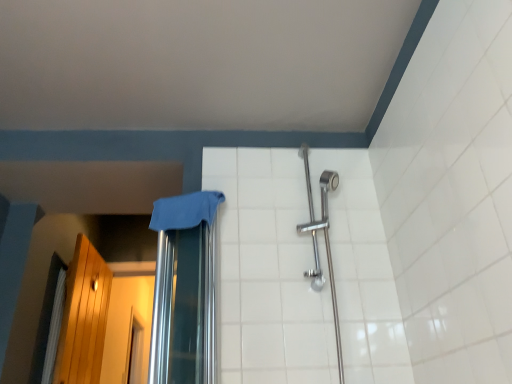
Question: Considering the relative sizes of white fabric shower curtain at left and blue fabric at center in the image provided, is white fabric shower curtain at left shorter than blue fabric at center?

Choices:
 (A) yes
 (B) no

Answer: (B)

Question: Considering the relative positions of white fabric shower curtain at left and blue fabric at center in the image provided, is white fabric shower curtain at left behind blue fabric at center?

Choices:
 (A) yes
 (B) no

Answer: (A)

Question: Is white fabric shower curtain at left at the left side of blue fabric at center?

Choices:
 (A) no
 (B) yes

Answer: (B)

Question: Does white fabric shower curtain at left have a greater height compared to blue fabric at center?

Choices:
 (A) yes
 (B) no

Answer: (A)

Question: From a real-world perspective, is white fabric shower curtain at left located higher than blue fabric at center?

Choices:
 (A) yes
 (B) no

Answer: (B)

Question: Is white fabric shower curtain at left to the left or to the right of wooden screen door at left in the image?

Choices:
 (A) right
 (B) left

Answer: (B)

Question: Considering the positions of white fabric shower curtain at left and wooden screen door at left in the image, is white fabric shower curtain at left taller or shorter than wooden screen door at left?

Choices:
 (A) tall
 (B) short

Answer: (B)

Question: From the image's perspective, is white fabric shower curtain at left above or below wooden screen door at left?

Choices:
 (A) below
 (B) above

Answer: (B)

Question: From a real-world perspective, is white fabric shower curtain at left physically located above or below wooden screen door at left?

Choices:
 (A) below
 (B) above

Answer: (A)

Question: In the image, is wooden screen door at left positioned in front of or behind white fabric shower curtain at left?

Choices:
 (A) behind
 (B) front

Answer: (A)

Question: Is wooden screen door at left wider or thinner than white fabric shower curtain at left?

Choices:
 (A) thin
 (B) wide

Answer: (B)

Question: In the image, is wooden screen door at left on the left side or the right side of white fabric shower curtain at left?

Choices:
 (A) left
 (B) right

Answer: (B)

Question: Is point (65, 311) closer or farther from the camera than point (45, 362)?

Choices:
 (A) closer
 (B) farther

Answer: (B)

Question: Is white ceramic tile at center spatially inside wooden screen door at left, or outside of it?

Choices:
 (A) outside
 (B) inside

Answer: (A)

Question: Based on their positions, is white ceramic tile at center located to the left or right of wooden screen door at left?

Choices:
 (A) right
 (B) left

Answer: (A)